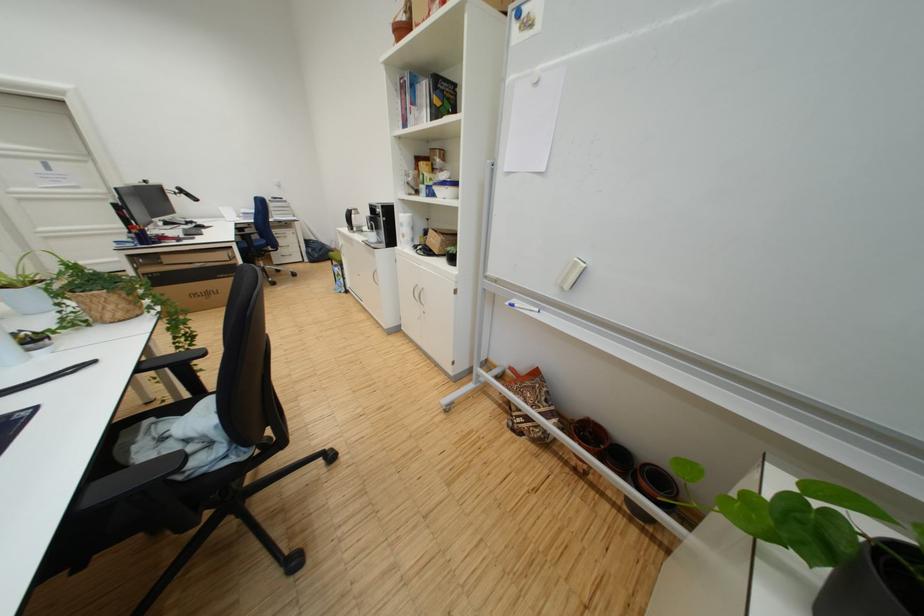
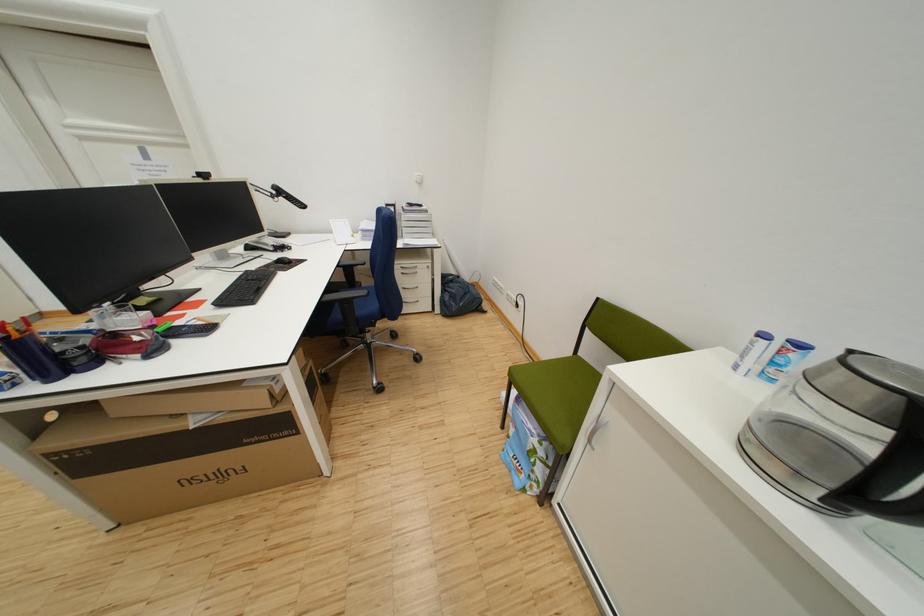
What movement of the cameraman would produce the second image?

The movement direction of the cameraman is left, forward.